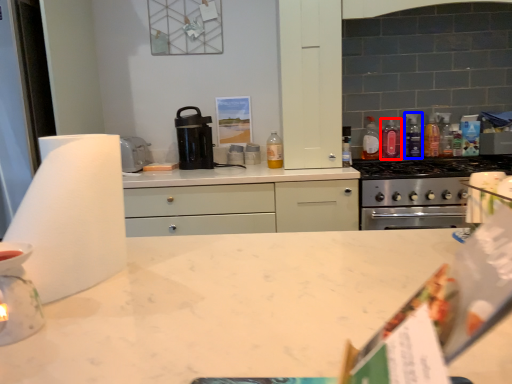
Question: Which of the following is the closest to the observer, bottle (highlighted by a red box) or bottle (highlighted by a blue box)?

Choices:
 (A) bottle
 (B) bottle

Answer: (B)